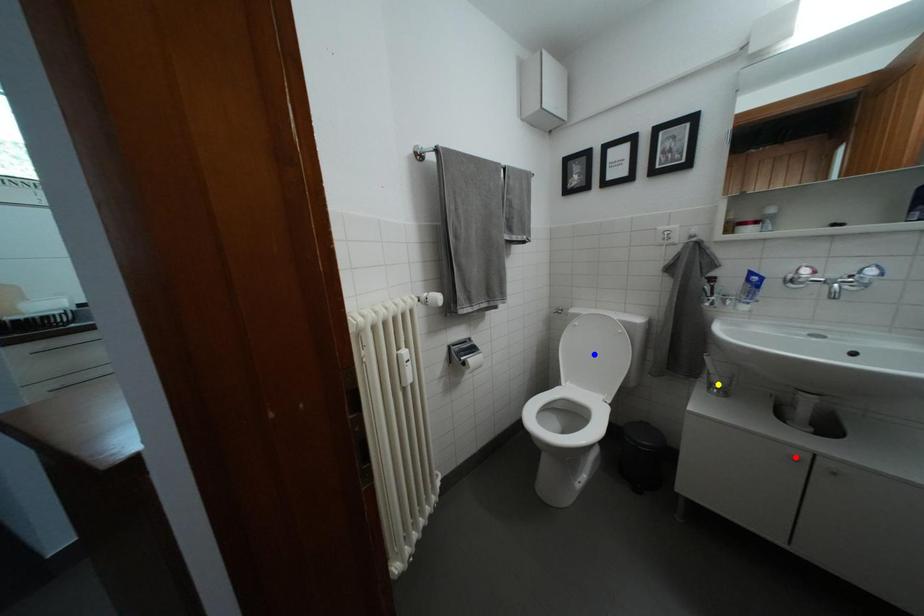
Order these from nearest to farthest:
red point, blue point, yellow point

red point → yellow point → blue point